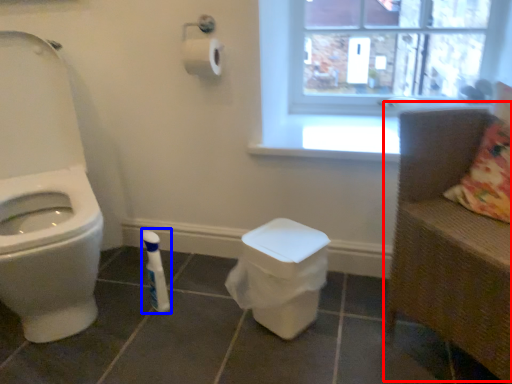
Question: Which object is closer to the camera taking this photo, armchair (highlighted by a red box) or toiletry (highlighted by a blue box)?

Choices:
 (A) armchair
 (B) toiletry

Answer: (A)